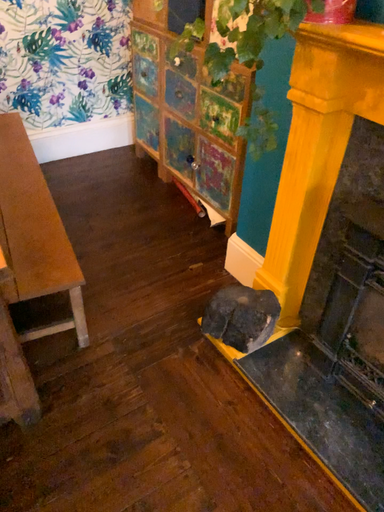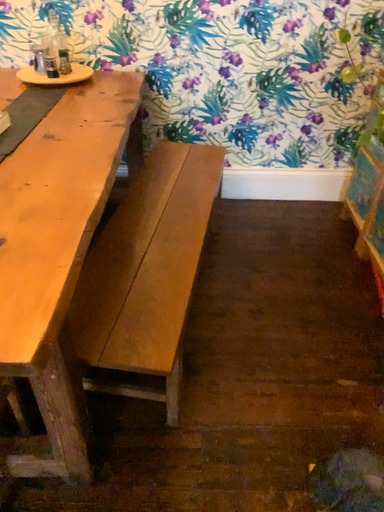
Question: How did the camera likely rotate when shooting the video?

Choices:
 (A) rotated upward
 (B) rotated downward

Answer: (A)